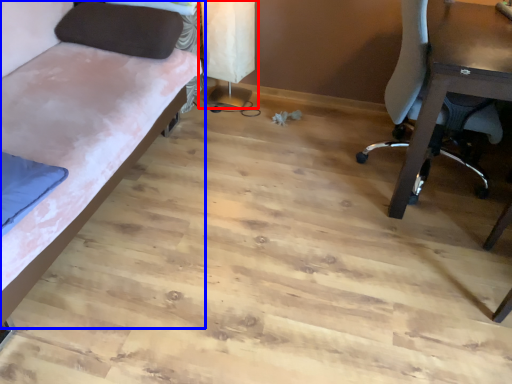
Question: Which object appears closest to the camera in this image, table lamp (highlighted by a red box) or studio couch (highlighted by a blue box)?

Choices:
 (A) table lamp
 (B) studio couch

Answer: (B)